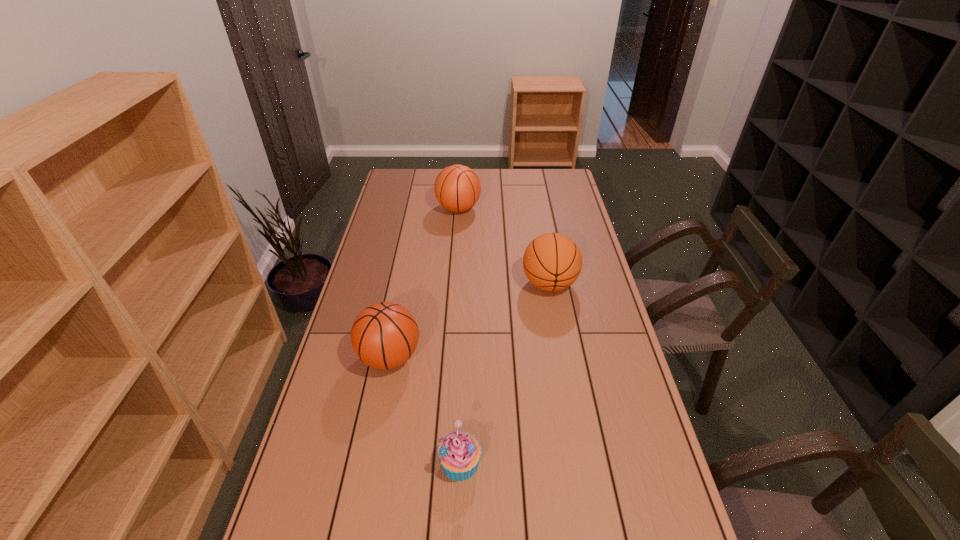
The image size is (960, 540). Find the location of `object present at the left edge`. object present at the left edge is located at coordinates (384, 335).

Image resolution: width=960 pixels, height=540 pixels. In order to click on object present at the right edge in this screenshot , I will do `click(552, 262)`.

This screenshot has width=960, height=540. I want to click on free space at the far edge of the desktop, so click(511, 172).

The height and width of the screenshot is (540, 960). I want to click on free location at the left edge, so click(384, 194).

In the image, there is a desktop. At what (x,y) coordinates should I click in order to perform the action: click on vacant space at the right edge. Please return your answer as a coordinate pair (x, y). This screenshot has height=540, width=960. Looking at the image, I should click on (552, 222).

The height and width of the screenshot is (540, 960). In the image, there is a desktop. What are the coordinates of `vacant space at the far left corner` in the screenshot? It's located at (401, 186).

Find the location of a particular element. Image resolution: width=960 pixels, height=540 pixels. vacant area at the far right corner is located at coordinates (556, 188).

The width and height of the screenshot is (960, 540). Find the location of `empty space between the rightmost basketball and the nearest basketball`. empty space between the rightmost basketball and the nearest basketball is located at coordinates (469, 321).

Identify the location of unoccupied position between the nearest basketball and the muffin. This screenshot has height=540, width=960. (425, 410).

Where is `free spot between the second nearest object and the rightmost basketball`? free spot between the second nearest object and the rightmost basketball is located at coordinates (469, 321).